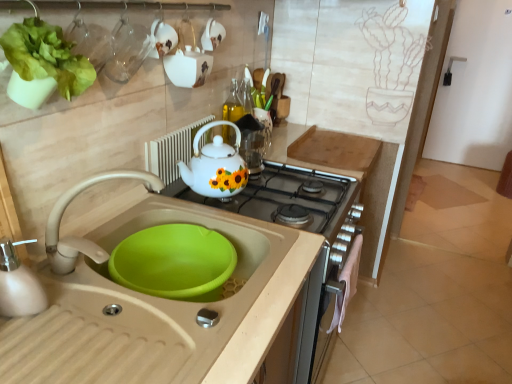
Question: Is beige plastic sink at lower left outside white glossy teapot at center?

Choices:
 (A) no
 (B) yes

Answer: (B)

Question: Can you confirm if beige plastic sink at lower left is smaller than white glossy teapot at center?

Choices:
 (A) yes
 (B) no

Answer: (B)

Question: Is beige plastic sink at lower left looking in the opposite direction of white glossy teapot at center?

Choices:
 (A) yes
 (B) no

Answer: (B)

Question: Considering the relative sizes of beige plastic sink at lower left and white glossy teapot at center in the image provided, is beige plastic sink at lower left thinner than white glossy teapot at center?

Choices:
 (A) no
 (B) yes

Answer: (A)

Question: Does beige plastic sink at lower left lie behind white glossy teapot at center?

Choices:
 (A) no
 (B) yes

Answer: (A)

Question: Is point (462, 258) positioned closer to the camera than point (268, 276)?

Choices:
 (A) farther
 (B) closer

Answer: (A)

Question: Is beige tile at lower right in front of or behind beige plastic sink at lower left in the image?

Choices:
 (A) behind
 (B) front

Answer: (A)

Question: From the image's perspective, is beige tile at lower right above or below beige plastic sink at lower left?

Choices:
 (A) above
 (B) below

Answer: (B)

Question: Considering the positions of beige tile at lower right and beige plastic sink at lower left in the image, is beige tile at lower right bigger or smaller than beige plastic sink at lower left?

Choices:
 (A) big
 (B) small

Answer: (B)

Question: Is beige plastic sink at lower left wider or thinner than matte beige faucet at sink left?

Choices:
 (A) wide
 (B) thin

Answer: (A)

Question: Is beige plastic sink at lower left situated inside matte beige faucet at sink left or outside?

Choices:
 (A) outside
 (B) inside

Answer: (A)

Question: From a real-world perspective, is beige plastic sink at lower left above or below matte beige faucet at sink left?

Choices:
 (A) below
 (B) above

Answer: (A)

Question: In terms of size, does beige plastic sink at lower left appear bigger or smaller than matte beige faucet at sink left?

Choices:
 (A) small
 (B) big

Answer: (B)

Question: Is transparent glass cup at upper left bigger or smaller than white ceramic teapot at upper center, the second appliance from the top?

Choices:
 (A) big
 (B) small

Answer: (A)

Question: Do you think transparent glass cup at upper left is within white ceramic teapot at upper center, the second appliance from the top, or outside of it?

Choices:
 (A) outside
 (B) inside

Answer: (A)